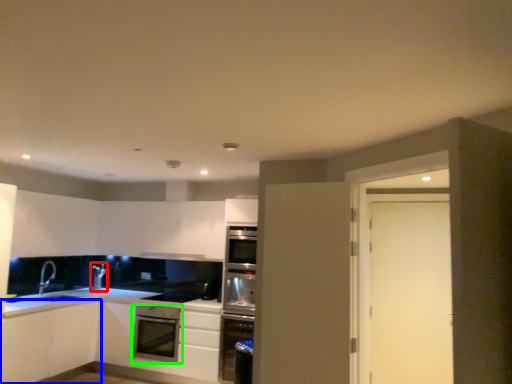
Question: Considering the real-world distances, which object is farthest from appliance (highlighted by a red box)? cabinetry (highlighted by a blue box) or kitchen appliance (highlighted by a green box)?

Choices:
 (A) cabinetry
 (B) kitchen appliance

Answer: (B)